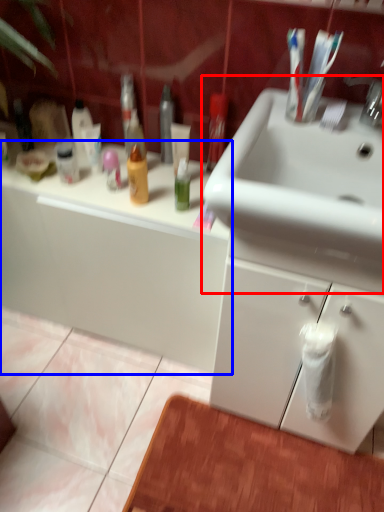
Question: Which object appears farthest to the camera in this image, sink (highlighted by a red box) or bathroom cabinet (highlighted by a blue box)?

Choices:
 (A) sink
 (B) bathroom cabinet

Answer: (B)